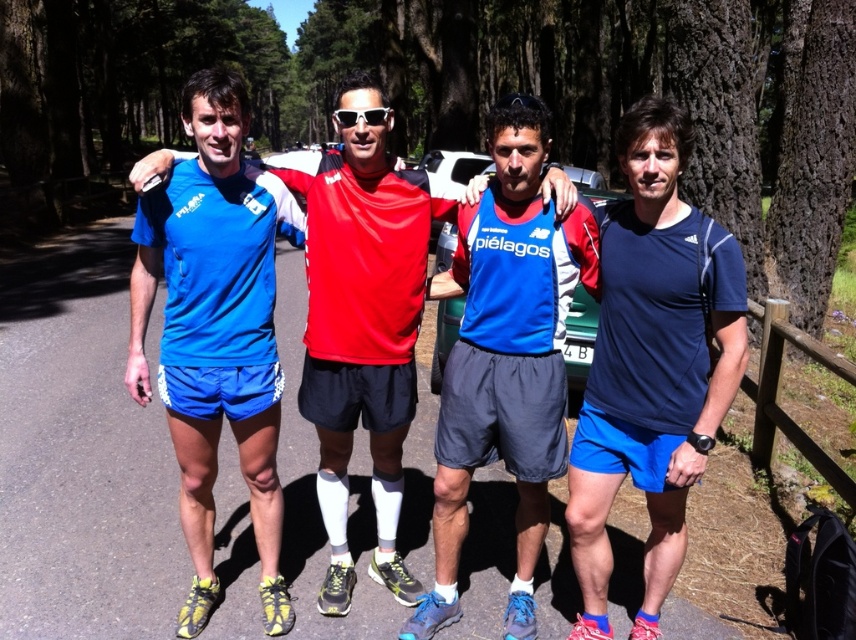
Who is positioned more to the left, navy blue fabric shirt at right or blue fabric shirt at center?

From the viewer's perspective, blue fabric shirt at center appears more on the left side.

Who is more forward, (736,273) or (495,244)?

Point (736,273) is more forward.

Locate an element on the screen. The image size is (856, 640). navy blue fabric shirt at right is located at coordinates (652, 364).

Based on the photo, can you confirm if navy blue fabric shirt at right is smaller than sunglasses at center?

No.

Based on the photo, is navy blue fabric shirt at right bigger than sunglasses at center?

Correct, navy blue fabric shirt at right is larger in size than sunglasses at center.

You are a GUI agent. You are given a task and a screenshot of the screen. Output one action in this format:
    pyautogui.click(x=<x>, y=<y>)
    Task: Click on the navy blue fabric shirt at right
    The height and width of the screenshot is (640, 856).
    Given the screenshot: What is the action you would take?
    pyautogui.click(x=652, y=364)

Is smooth bark tree at center shorter than matte blue shorts at center?

No, smooth bark tree at center is not shorter than matte blue shorts at center.

Is smooth bark tree at center positioned in front of matte blue shorts at center?

Result: No.

You are a GUI agent. You are given a task and a screenshot of the screen. Output one action in this format:
    pyautogui.click(x=<x>, y=<y>)
    Task: Click on the smooth bark tree at center
    The height and width of the screenshot is (640, 856).
    Given the screenshot: What is the action you would take?
    (x=462, y=92)